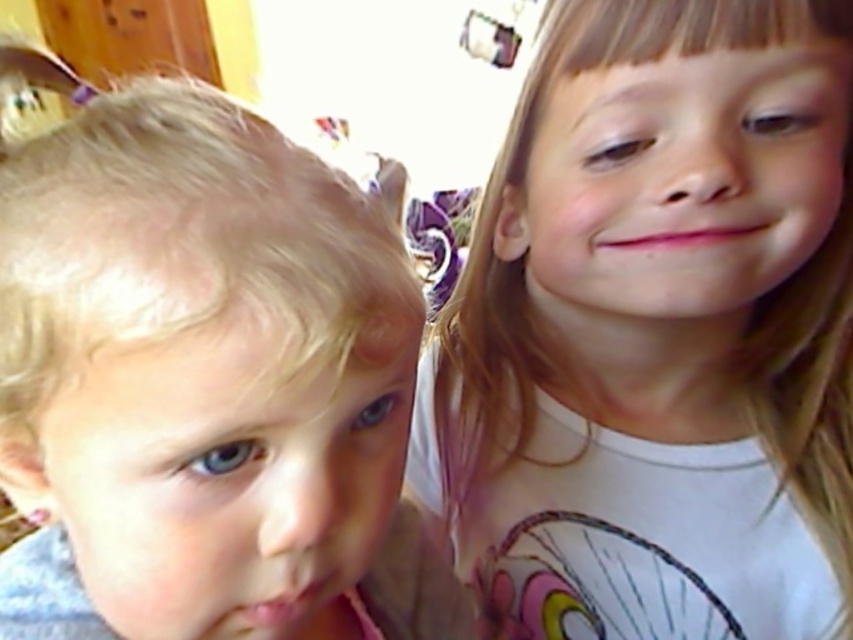
You are a photographer adjusting the lighting in the room. You notice the smooth white shirt at right and the pink matte lips at center. Which object would require more light adjustment to ensure proper exposure, considering their size?

The smooth white shirt at right has a larger size compared to the pink matte lips at center, so it would require more light adjustment to ensure proper exposure due to its larger surface area.

You are a photographer adjusting the focus of your camera. You want to ensure that both the smooth white shirt at right and the pink matte lips at lower left are in focus. Based on their positions, which object should you focus on first to achieve this?

To ensure both the smooth white shirt at right and the pink matte lips at lower left are in focus, you should focus on the smooth white shirt at right first since it is closer to the viewer. This allows the depth of field to cover the pink matte lips at lower left, which is farther away.

You are a photographer trying to capture a closeup of the smooth white shirt at right and the pink matte lips at lower left. Since you want both objects to appear the same size in the photo, which object should you move closer to the camera?

The smooth white shirt at right is bigger than the pink matte lips at lower left, so you should move the pink matte lips at lower left closer to the camera to make them appear larger in the photo.